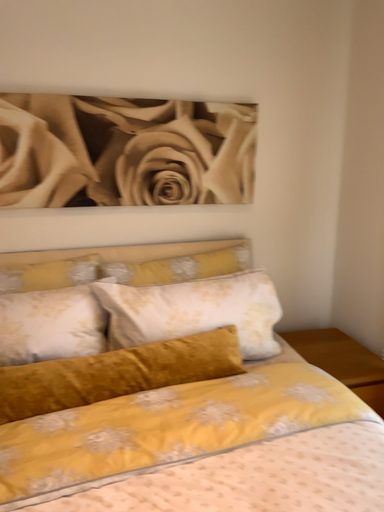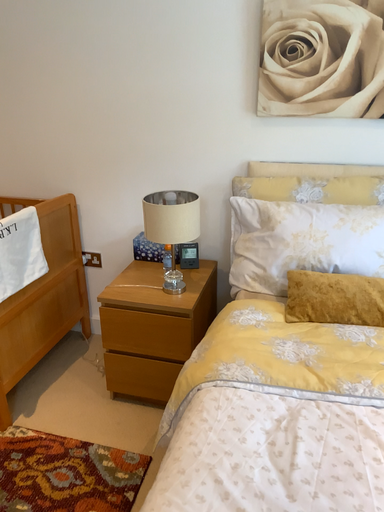
Question: How did the camera likely rotate when shooting the video?

Choices:
 (A) rotated right
 (B) rotated left

Answer: (B)